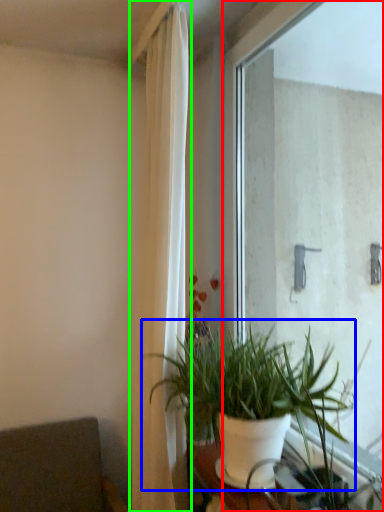
Question: Which object is positioned farthest from window (highlighted by a red box)? Select from houseplant (highlighted by a blue box) and curtain (highlighted by a green box).

Choices:
 (A) houseplant
 (B) curtain

Answer: (B)